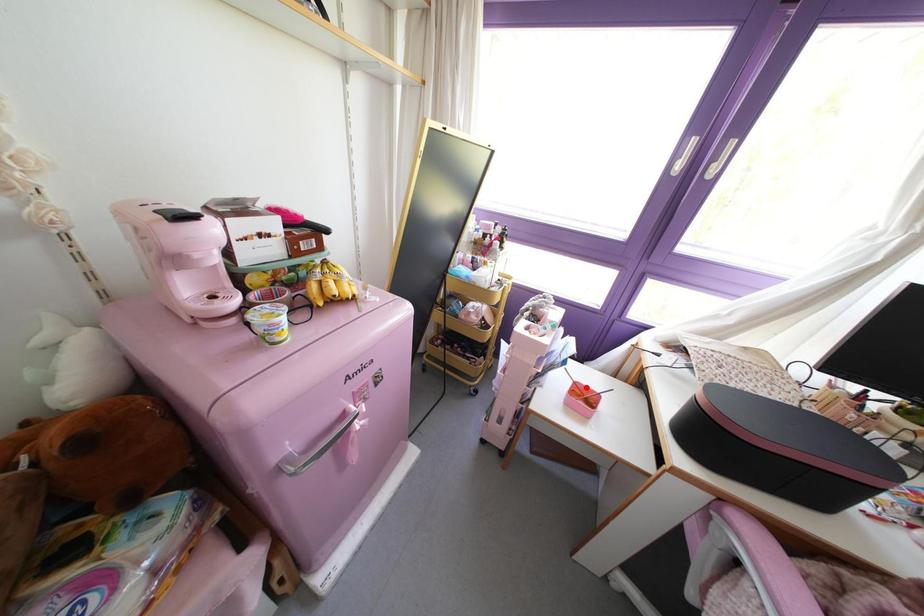
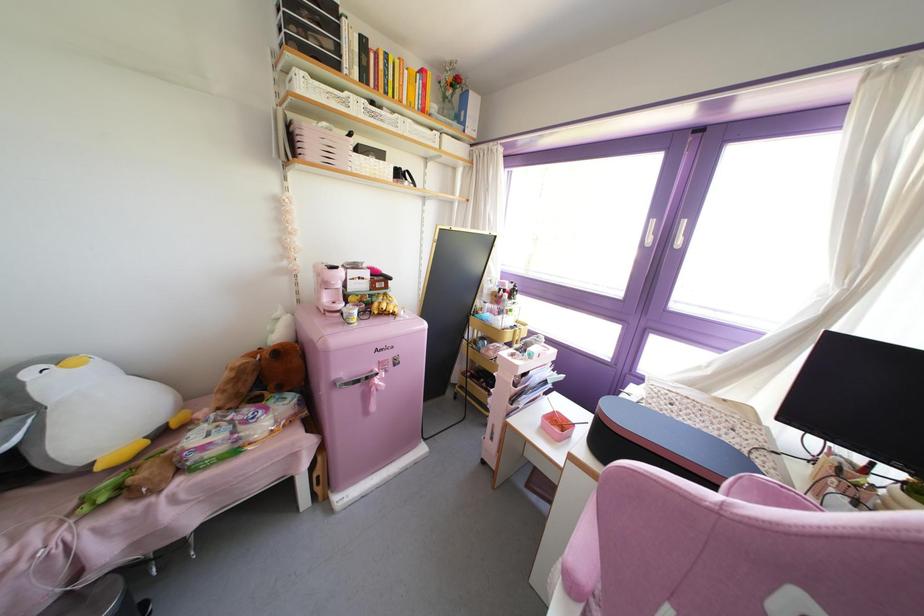
Question: I am providing you with two images of the same scene from different viewpoints. Given a red point in image1, look at the same physical point in image2. Is it:

Choices:
 (A) Closer to the viewpoint
 (B) Farther from the viewpoint

Answer: (A)